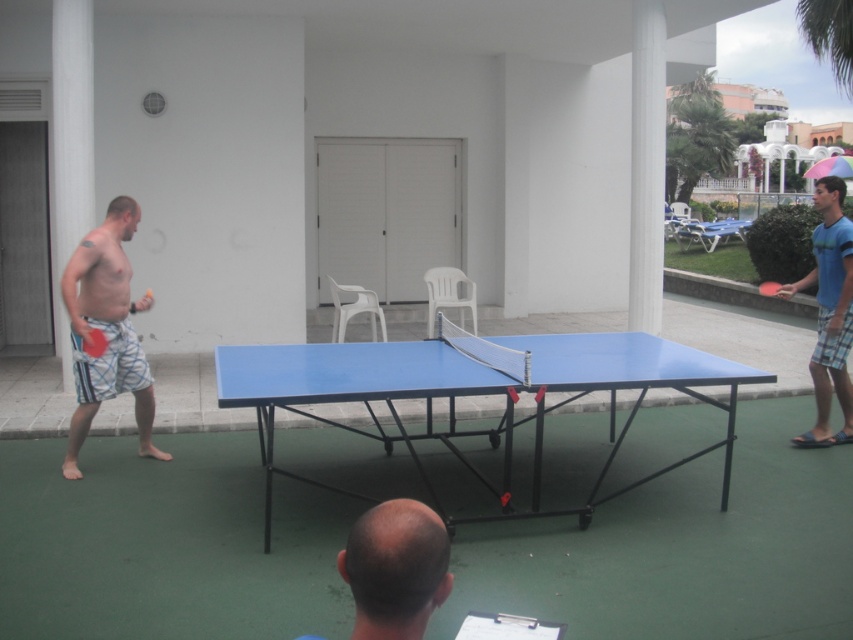
Question: Does blue plastic table at center have a larger size compared to matte blue shorts at left?

Choices:
 (A) yes
 (B) no

Answer: (A)

Question: Based on their relative distances, which object is nearer to the blue plastic table at center?

Choices:
 (A) blue plaid shorts at right
 (B) matte blue shorts at left

Answer: (B)

Question: Can you confirm if blue plaid shorts at right is thinner than blue plastic table tennis table at center?

Choices:
 (A) yes
 (B) no

Answer: (B)

Question: Among these objects, which one is nearest to the camera?

Choices:
 (A) blue plaid shorts at right
 (B) matte blue shorts at left
 (C) blue matte table tennis table at center

Answer: (B)

Question: Is blue plastic table at center bigger than matte blue shorts at left?

Choices:
 (A) yes
 (B) no

Answer: (A)

Question: Considering the real-world distances, which object is closest to the blue plastic table tennis table at center?

Choices:
 (A) blue plaid shorts at right
 (B) blue matte table tennis table at center
 (C) blue plastic table at center

Answer: (A)